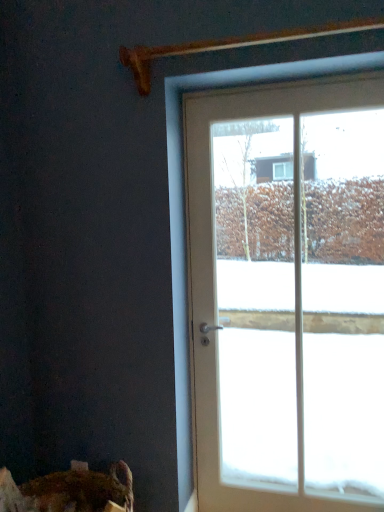
This screenshot has height=512, width=384. I want to click on white glass door at upper right, so click(x=288, y=295).

This screenshot has height=512, width=384. What do you see at coordinates (288, 295) in the screenshot? I see `white glass door at upper right` at bounding box center [288, 295].

You are a GUI agent. You are given a task and a screenshot of the screen. Output one action in this format:
    pyautogui.click(x=<x>, y=<y>)
    Task: Click on the white glass door at upper right
    
    Given the screenshot: What is the action you would take?
    pyautogui.click(x=288, y=295)